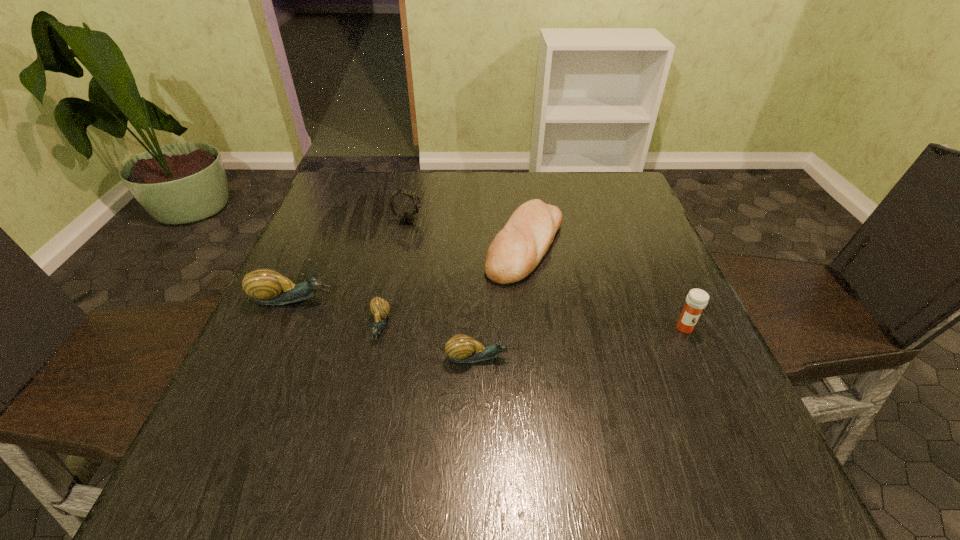
Please point out where to position a new escargot on the right to maintain spacing. Please provide its 2D coordinates. Your answer should be formatted as a tuple, i.e. [(x, y)], where the tuple contains the x and y coordinates of a point satisfying the conditions above.

[(592, 393)]